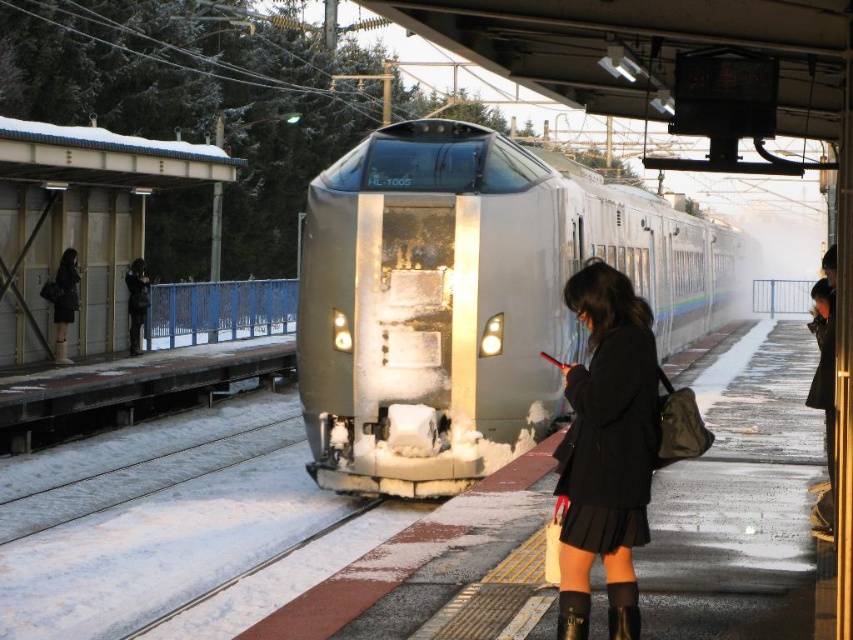
Question: Which object appears farthest from the camera in this image?

Choices:
 (A) black leather boot at lower center
 (B) brown suede boot at lower center
 (C) sleek silver train at center

Answer: (C)

Question: Which of the following is the farthest from the observer?

Choices:
 (A) (578, 627)
 (B) (514, 152)
 (C) (616, 584)
 (D) (590, 317)

Answer: (B)

Question: Does brown suede boot at lower center have a greater width compared to black leather boot at lower center?

Choices:
 (A) no
 (B) yes

Answer: (B)

Question: Can you confirm if black matte coat at center is thinner than black leather boot at lower center?

Choices:
 (A) yes
 (B) no

Answer: (B)

Question: Is matte black coat at left smaller than brown suede boot at lower center?

Choices:
 (A) no
 (B) yes

Answer: (A)

Question: Which is nearer to the brown suede boot at lower center?

Choices:
 (A) black matte coat at center
 (B) matte black coat at left
 (C) black leather boot at lower center

Answer: (C)